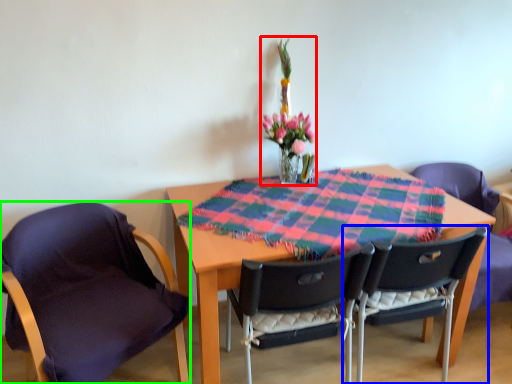
Question: Which object is positioned closest to floral arrangement (highlighted by a red box)? Select from chair (highlighted by a blue box) and chair (highlighted by a green box).

Choices:
 (A) chair
 (B) chair

Answer: (A)